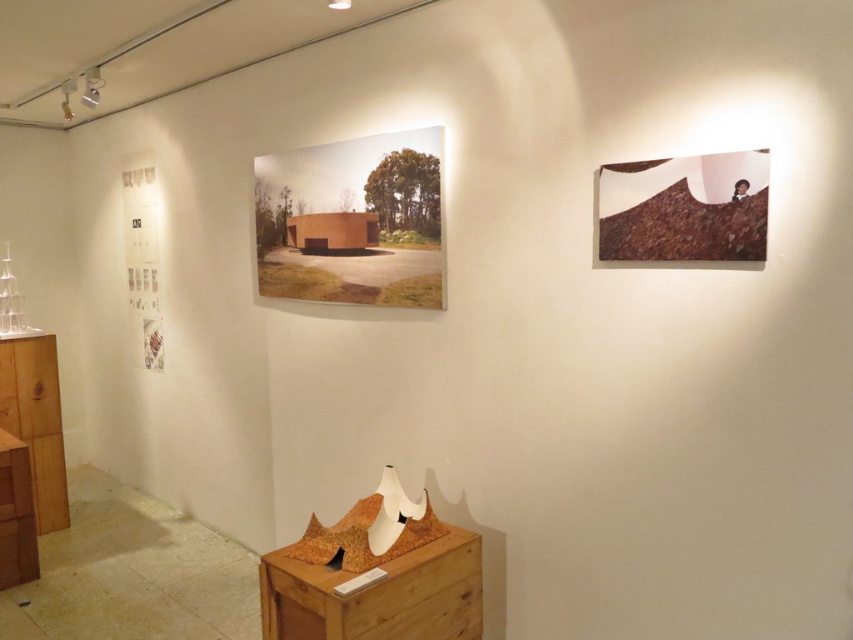
Question: Based on their relative distances, which object is nearer to the wooden dresser at left?

Choices:
 (A) matte brown painting at center
 (B) wooden dresser at lower center
 (C) brown textured fabric at upper right
 (D) wooden dresser at lower left

Answer: (D)

Question: Which point is farther to the camera?

Choices:
 (A) wooden dresser at lower center
 (B) wooden dresser at lower left

Answer: (B)

Question: Can you confirm if brown textured fabric at upper right is positioned to the right of wooden dresser at left?

Choices:
 (A) yes
 (B) no

Answer: (A)

Question: Which object is closer to the camera taking this photo?

Choices:
 (A) brown textured fabric at upper right
 (B) matte brown painting at center

Answer: (A)

Question: From the image, what is the correct spatial relationship of matte brown painting at center in relation to brown textured fabric at upper right?

Choices:
 (A) left
 (B) right

Answer: (A)

Question: Is matte brown painting at center smaller than wooden dresser at lower center?

Choices:
 (A) no
 (B) yes

Answer: (A)